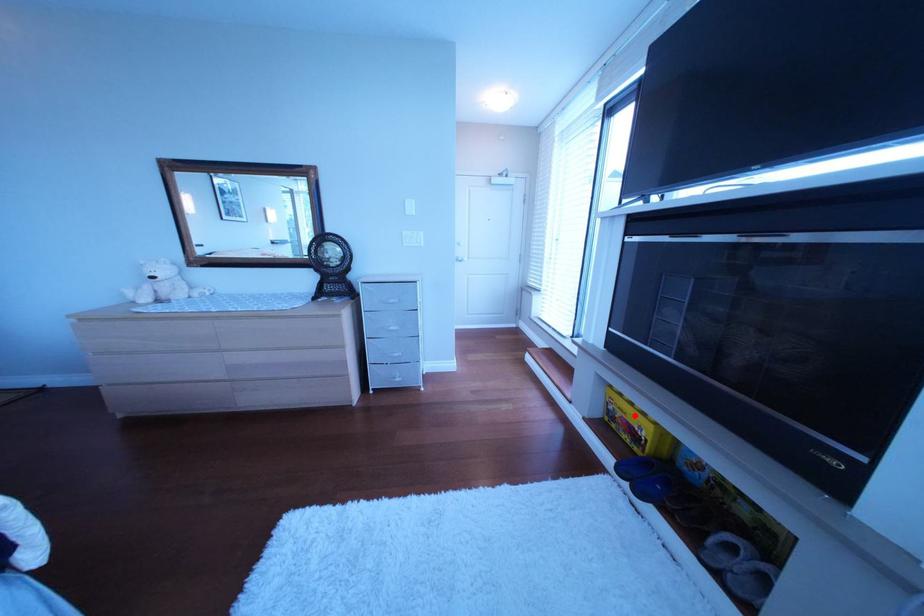
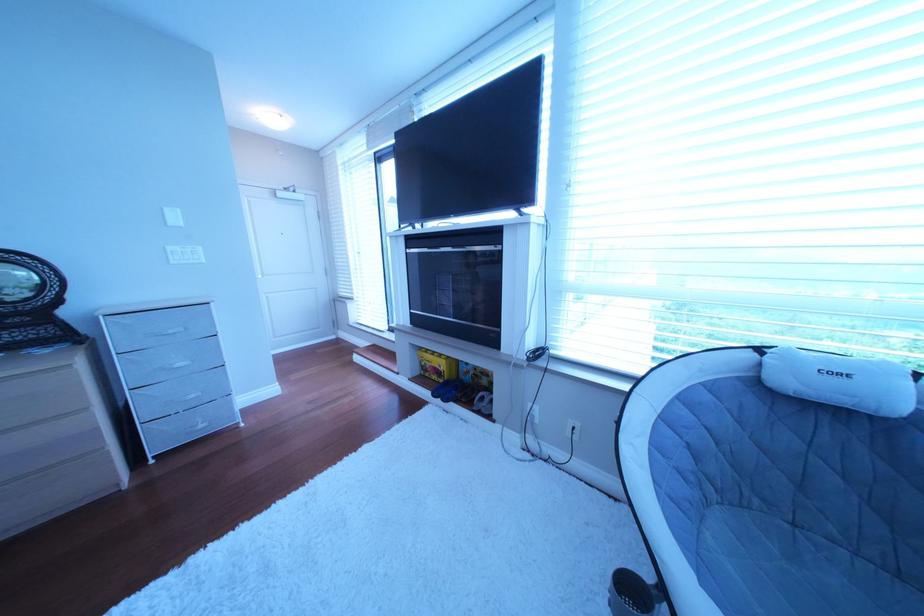
Question: I am providing you with two images of the same scene from different viewpoints. In image1, a red point is highlighted. Considering the same 3D point in image2, which of the following is correct?

Choices:
 (A) It is closer
 (B) It is farther

Answer: (B)